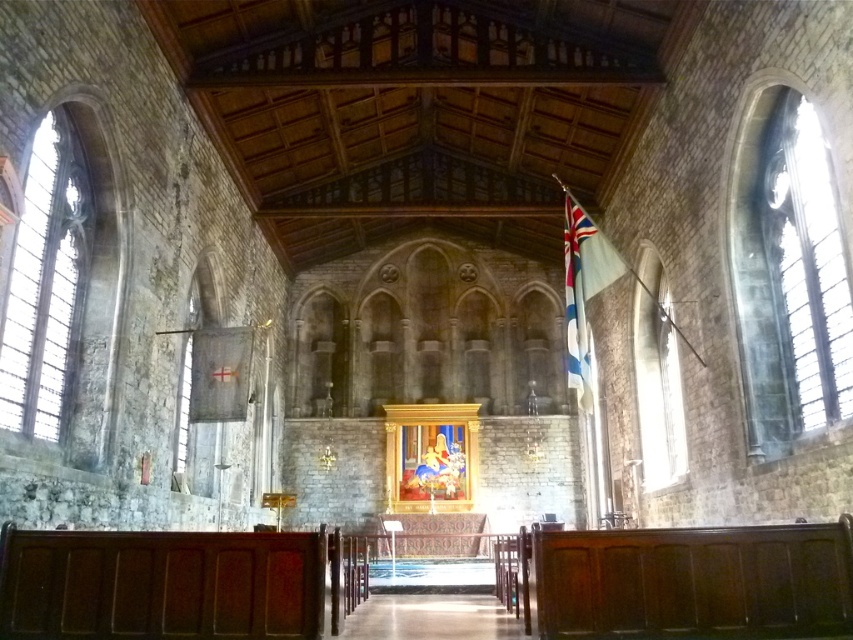
Is clear glass window at right to the left of white fabric flag at upper right from the viewer's perspective?

No, clear glass window at right is not to the left of white fabric flag at upper right.

Find the location of a particular element. clear glass window at right is located at coordinates (788, 275).

Identify the location of clear glass window at right. [788, 275].

This screenshot has height=640, width=853. I want to click on clear glass window at right, so click(x=788, y=275).

Between clear glass window at right and clear glass window at left, which one is positioned lower?

clear glass window at right is below.

Is clear glass window at right taller than clear glass window at left?

Indeed, clear glass window at right has a greater height compared to clear glass window at left.

This screenshot has width=853, height=640. What are the coordinates of `clear glass window at right` in the screenshot? It's located at (788, 275).

Which is more to the left, clear glass window at left or white fabric flag at upper right?

clear glass window at left

Can you confirm if clear glass window at left is shorter than white fabric flag at upper right?

Correct, clear glass window at left is not as tall as white fabric flag at upper right.

Is point (68, 268) in front of point (572, 196)?

Yes, it is in front of point (572, 196).

Locate an element on the screen. Image resolution: width=853 pixels, height=640 pixels. clear glass window at left is located at coordinates (45, 284).